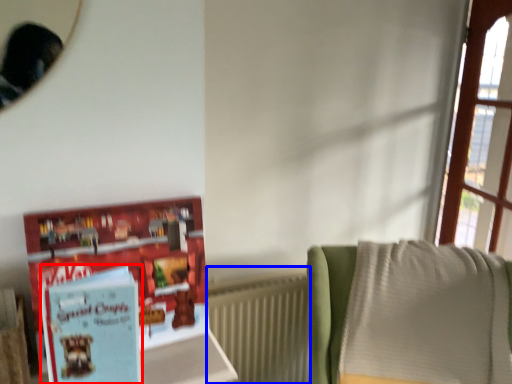
Question: Which object is further to the camera taking this photo, paperback book (highlighted by a red box) or radiator (highlighted by a blue box)?

Choices:
 (A) paperback book
 (B) radiator

Answer: (B)